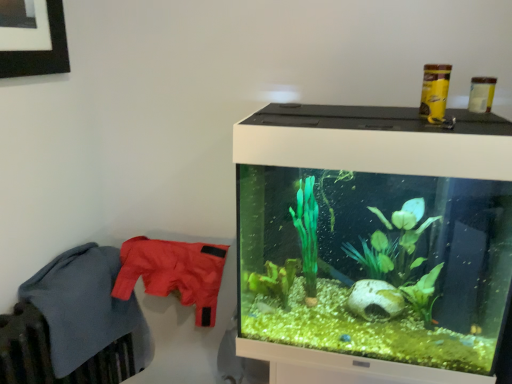
At what (x,y) coordinates should I click in order to perform the action: click on free space above soft fleece blanket at left, the 1th clothing in the left-to-right sequence (from a real-world perspective). Please return your answer as a coordinate pair (x, y). This screenshot has width=512, height=384. Looking at the image, I should click on (53, 283).